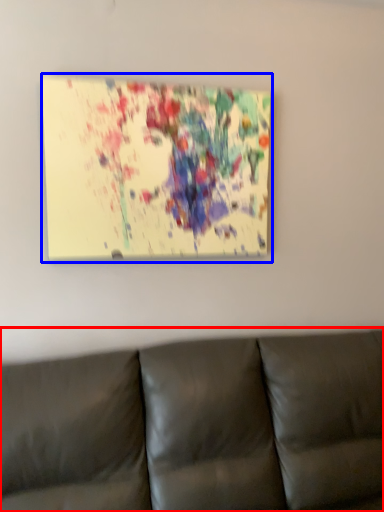
Question: Which point is further to the camera, studio couch (highlighted by a red box) or picture frame (highlighted by a blue box)?

Choices:
 (A) studio couch
 (B) picture frame

Answer: (B)